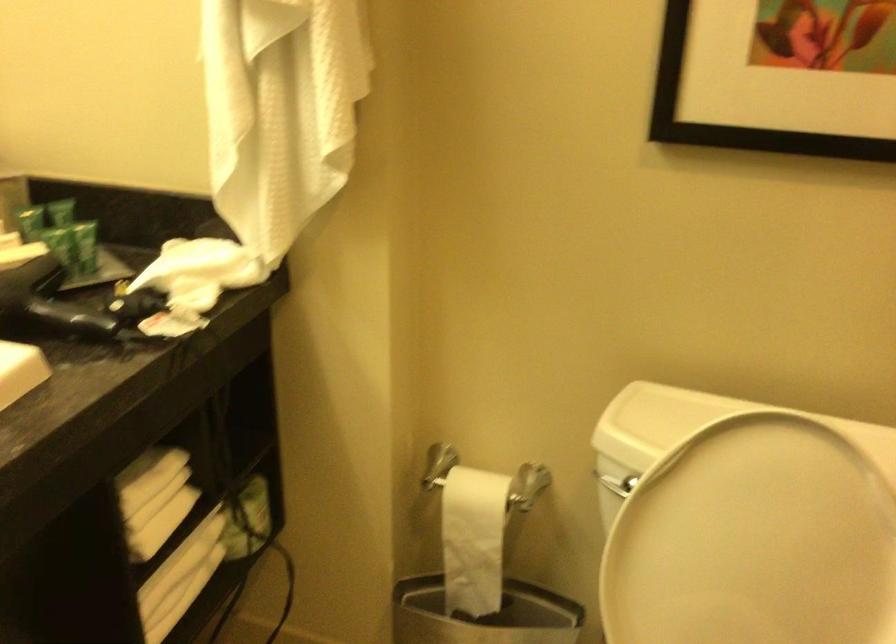
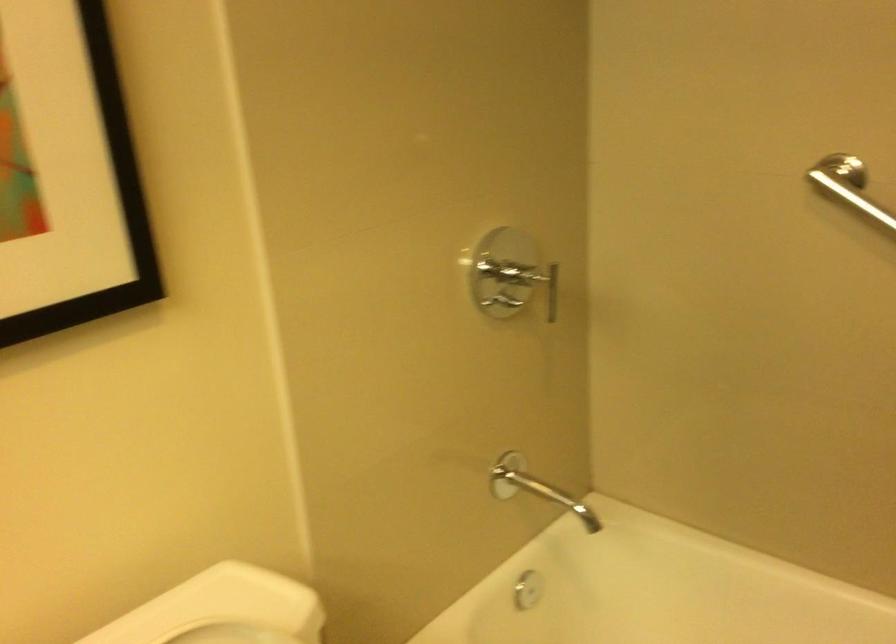
Question: Based on the continuous images, in which direction is the camera rotating? Reply with the corresponding letter.

Choices:
 (A) Left
 (B) Right
 (C) Up
 (D) Down

Answer: (B)